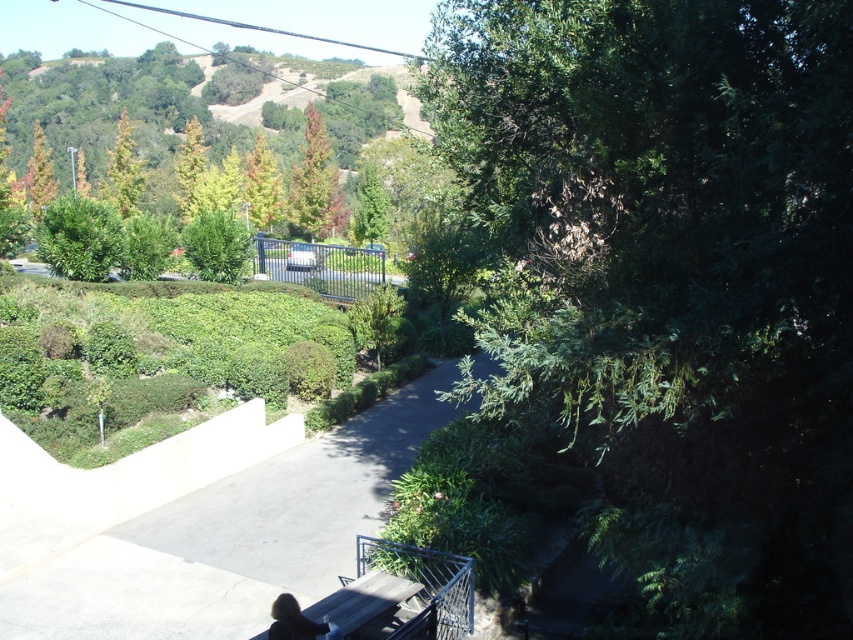
Is green leafy tree at right positioned behind smooth concrete path at center?

No, green leafy tree at right is closer to the viewer.

Is point (758, 61) closer to camera compared to point (196, 595)?

Yes, it is in front of point (196, 595).

Is point (614, 113) behind point (303, 492)?

No.

Identify the location of green leafy tree at right. The height and width of the screenshot is (640, 853). (675, 259).

Is smooth concrete path at center to the right of dark brown leather jacket at lower center from the viewer's perspective?

Incorrect, smooth concrete path at center is not on the right side of dark brown leather jacket at lower center.

Which of these two, smooth concrete path at center or dark brown leather jacket at lower center, stands taller?

smooth concrete path at center is taller.

Is point (450, 406) positioned after point (334, 625)?

Yes, point (450, 406) is behind point (334, 625).

Where is `smooth concrete path at center`? The width and height of the screenshot is (853, 640). smooth concrete path at center is located at coordinates (231, 538).

Does green leafy tree at right come behind green matte tree at center?

No, it is in front of green matte tree at center.

Is green leafy tree at right positioned in front of green matte tree at center?

Yes, it is.

Find the location of a particular element. The width and height of the screenshot is (853, 640). green leafy tree at right is located at coordinates (675, 259).

Locate an element on the screen. The height and width of the screenshot is (640, 853). green leafy tree at right is located at coordinates (675, 259).